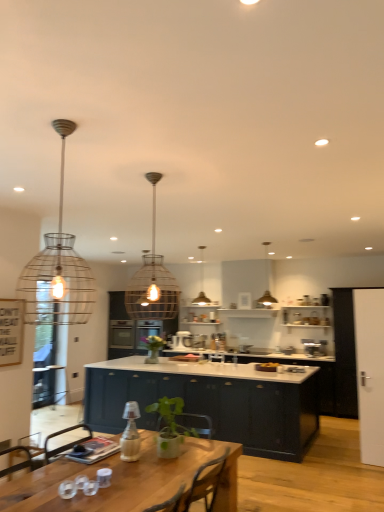
I want to click on vacant space situated above wire mesh pendant light at center, the 2th lamp in the front-to-back sequence (from a real-world perspective), so click(151, 174).